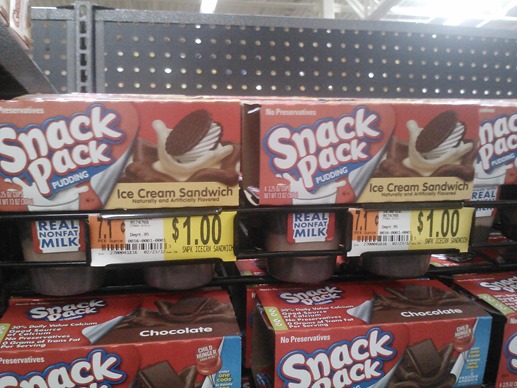
Locate an element on the screen. Image resolution: width=517 pixels, height=388 pixels. shelves is located at coordinates (278, 209), (301, 347).